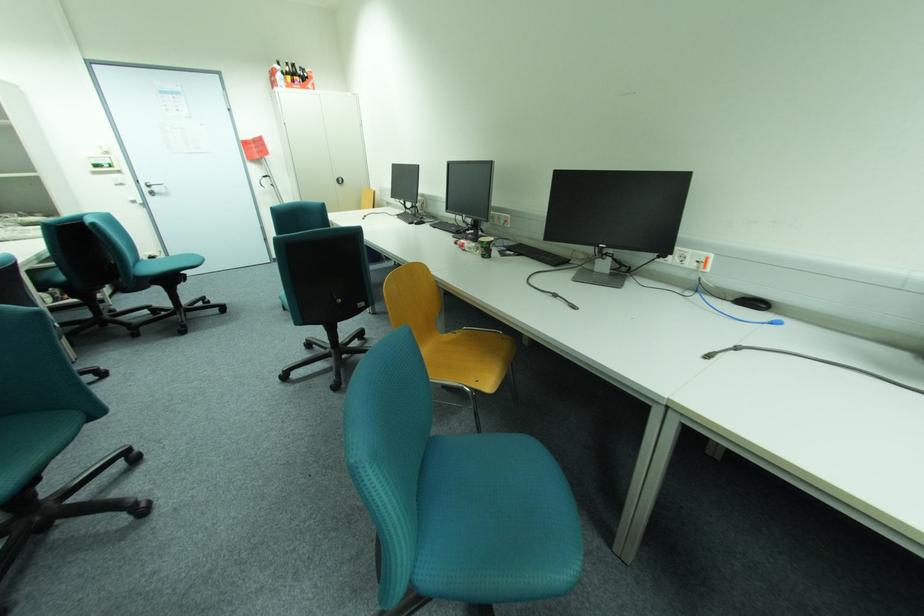
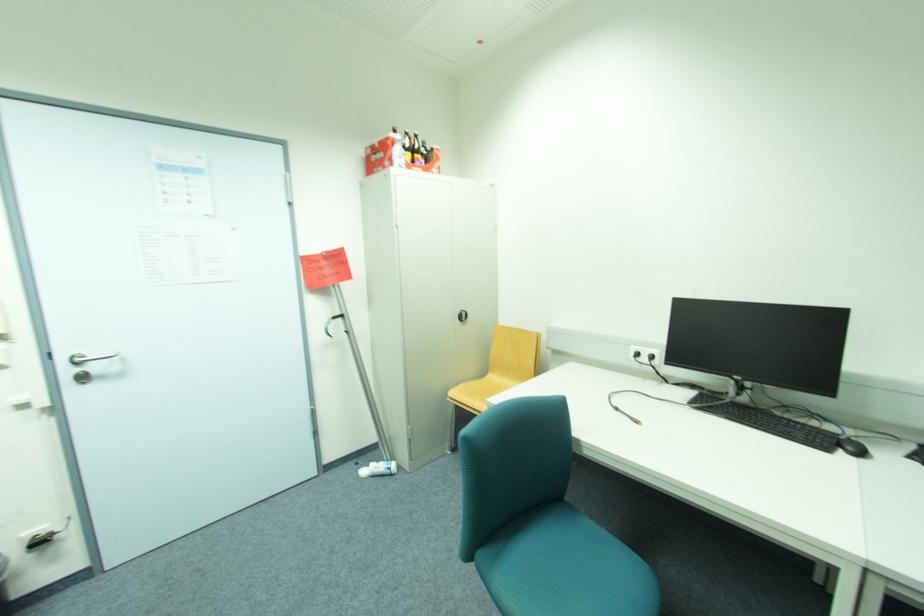
Where in the second image is the point corresponding to (271,177) from the first image?

(339, 317)